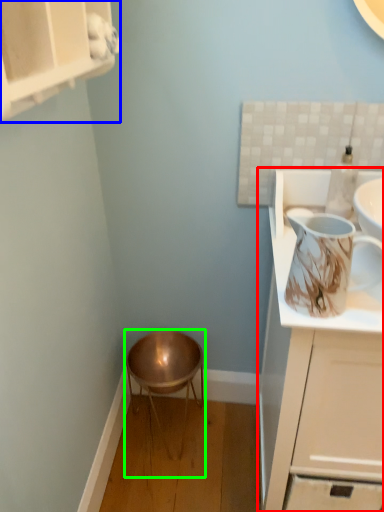
Question: Based on their relative distances, which object is nearer to cabinetry (highlighted by a red box)? Choose from cabinetry (highlighted by a blue box) and stool (highlighted by a green box).

Choices:
 (A) cabinetry
 (B) stool

Answer: (B)